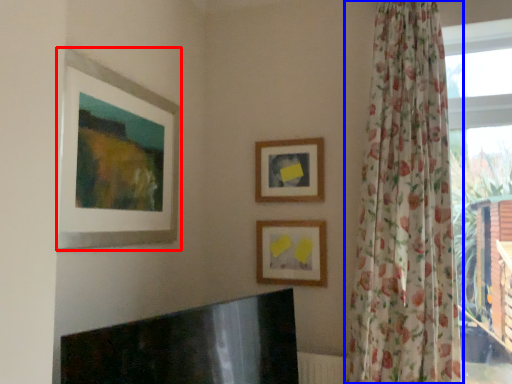
Question: Which of the following is the closest to the observer, picture frame (highlighted by a red box) or curtain (highlighted by a blue box)?

Choices:
 (A) picture frame
 (B) curtain

Answer: (A)